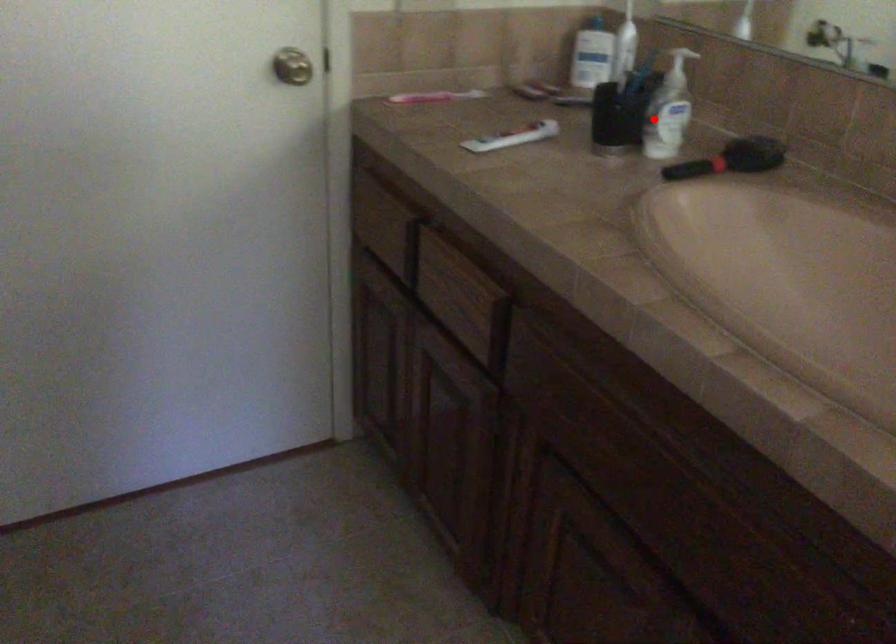
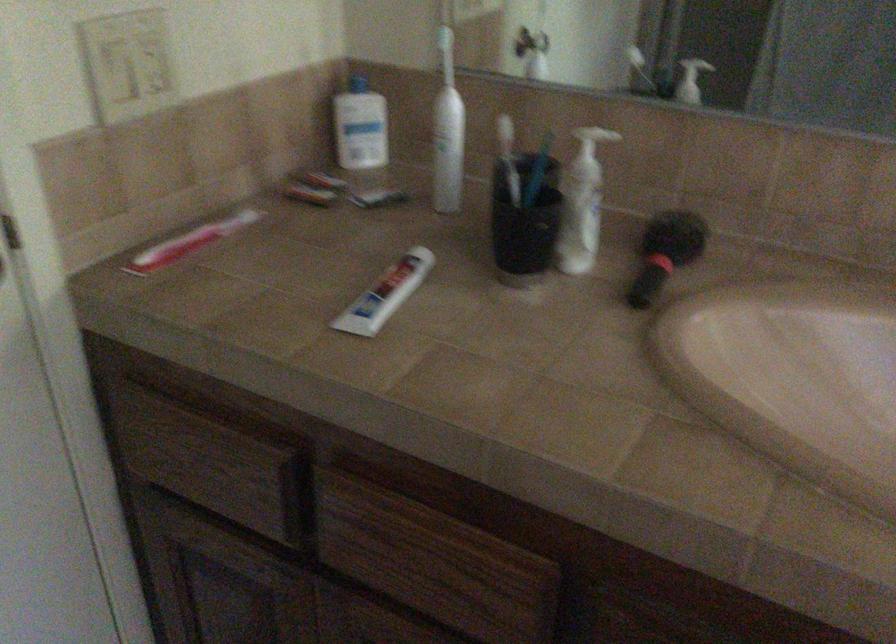
Question: I am providing you with two images of the same scene from different viewpoints. A red point is shown in image1. For the corresponding object point in image2, is it positioned nearer or farther from the camera?

Choices:
 (A) Nearer
 (B) Farther

Answer: (A)